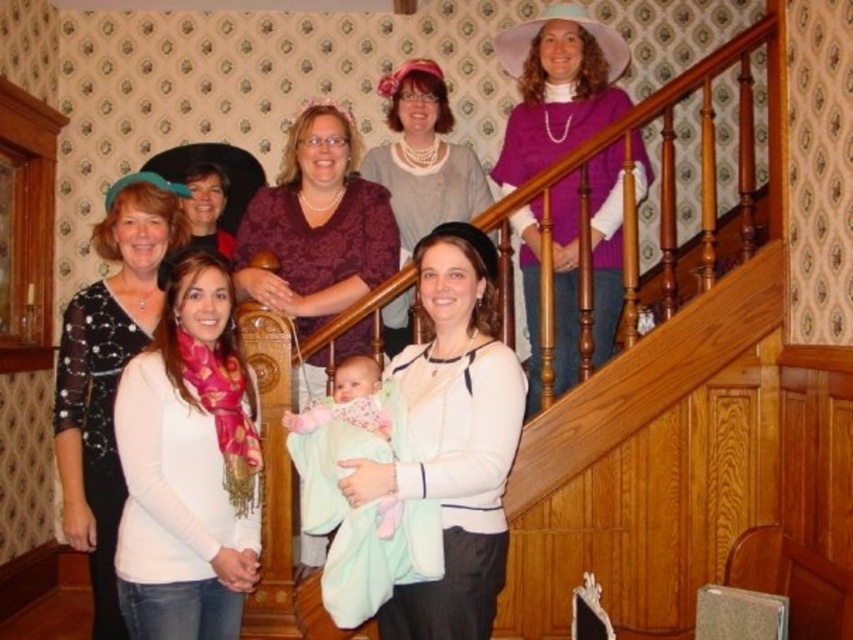
You are a photographer setting up a shoot in this room. You need to position a light source to illuminate the matte purple blouse at center without casting a shadow over the matte black hat at upper center. Where should you place the light source relative to the subjects?

The matte purple blouse at center is located below the matte black hat at upper center. To avoid casting a shadow on the hat, the light source should be placed above and behind the matte black hat at upper center, directing light downward toward the blouse while keeping the hat between the light and the blouse to block direct shadow casting.

You are taking a photo of the scene and want to focus on both point [256,300] and point [231,236]. Which point should you focus on first to ensure both are in focus?

You should focus on point [231,236] first because it is farther from the camera than point [256,300]. By focusing on the farther point, the closer point will also be within the depth of field.